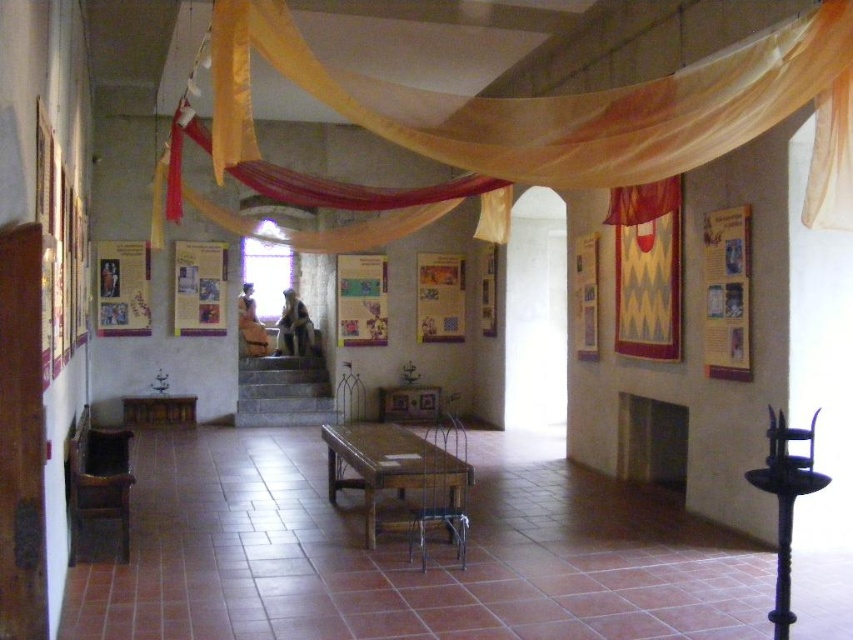
You are a visitor in this exhibit space and want to take a photo of the wooden table at center without any obstructions. Considering the translucent yellow fabric at upper center, will it block your view of the table?

The translucent yellow fabric at upper center and wooden table at center are 2.61 meters apart from each other. Since the fabric is above the table, it might cast a slight shadow or tint but won,t physically block the view as they are separated by a distance.

Consider the image. You are an event planner setting up a table in the exhibit space. The wooden table at center is already placed. You have a large decorative cloth that is the same size as the translucent yellow fabric at upper center. Where should you place the cloth to ensure it doesn

The translucent yellow fabric at upper center occupies less space than the wooden table at center, so placing the cloth on the wooden table at center would allow it to fit since the table is larger.

You are a visitor in this historical exhibit space. You want to take a photo of the wooden table at center without any obstruction from the translucent yellow fabric at upper center. Is it possible to do so from your current position?

The translucent yellow fabric at upper center is taller than the wooden table at center, so it is possible to take a photo of the wooden table at center without obstruction from the translucent yellow fabric at upper center by positioning yourself lower or angling the camera to avoid the fabric.